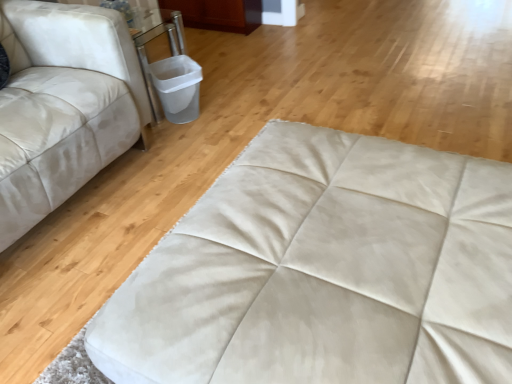
Question: From the image's perspective, is beige suede ottoman at center located above or below white leather studio couch at left?

Choices:
 (A) above
 (B) below

Answer: (B)

Question: Considering the positions of beige suede ottoman at center and white leather studio couch at left in the image, is beige suede ottoman at center taller or shorter than white leather studio couch at left?

Choices:
 (A) short
 (B) tall

Answer: (A)

Question: Considering their positions, is beige suede ottoman at center located in front of or behind white leather studio couch at left?

Choices:
 (A) front
 (B) behind

Answer: (A)

Question: In terms of height, does white leather studio couch at left look taller or shorter compared to beige suede ottoman at center?

Choices:
 (A) short
 (B) tall

Answer: (B)

Question: Visually, is white leather studio couch at left positioned to the left or to the right of beige suede ottoman at center?

Choices:
 (A) left
 (B) right

Answer: (A)

Question: Considering the positions of white leather studio couch at left and beige suede ottoman at center in the image, is white leather studio couch at left wider or thinner than beige suede ottoman at center?

Choices:
 (A) wide
 (B) thin

Answer: (B)

Question: Is white leather studio couch at left in front of or behind beige suede ottoman at center in the image?

Choices:
 (A) behind
 (B) front

Answer: (A)